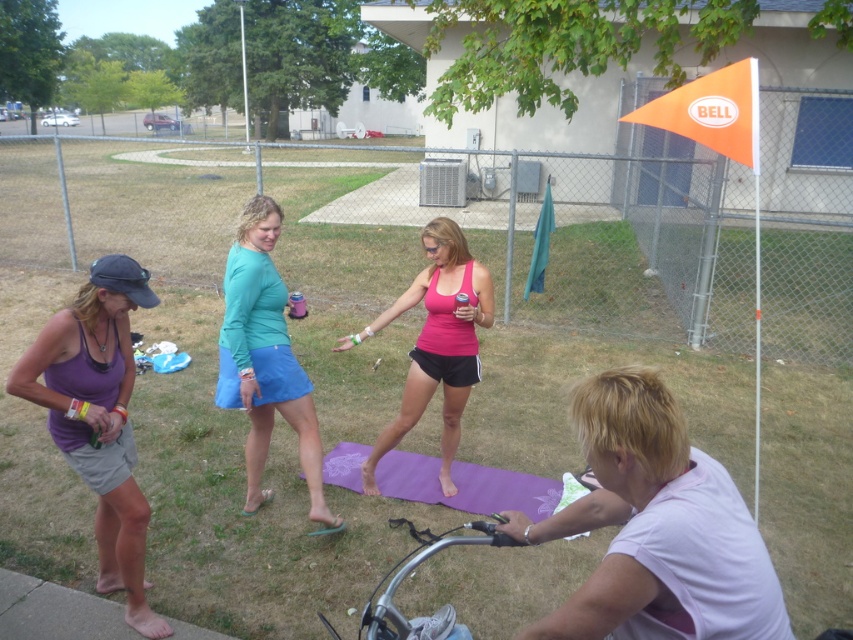
Question: Which of these objects is positioned farthest from the silver metallic bicycle handlebars at lower center?

Choices:
 (A) purple matte tank top at left
 (B) pink matte tank top at center
 (C) teal fabric skirt at center
 (D) purple yoga mat at center

Answer: (A)

Question: Which point is closer to the camera taking this photo?

Choices:
 (A) (397, 481)
 (B) (223, 342)
 (C) (451, 618)
 (D) (427, 365)

Answer: (C)

Question: Can you confirm if purple matte tank top at left is thinner than pink matte tank top at center?

Choices:
 (A) no
 (B) yes

Answer: (B)

Question: Which point is closer to the camera taking this photo?

Choices:
 (A) (22, 364)
 (B) (467, 248)
 (C) (486, 515)
 (D) (460, 541)

Answer: (D)

Question: Can you confirm if teal fabric skirt at center is positioned to the left of silver metallic bicycle handlebars at lower center?

Choices:
 (A) no
 (B) yes

Answer: (B)

Question: Where is pink matte tank top at center located in relation to purple yoga mat at center in the image?

Choices:
 (A) right
 (B) left

Answer: (B)